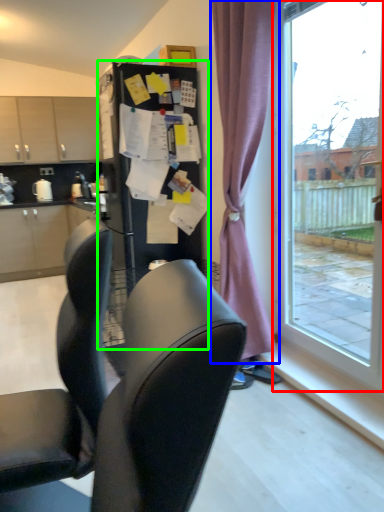
Question: Estimate the real-world distances between objects in this image. Which object is closer to window (highlighted by a red box), curtain (highlighted by a blue box) or fridge (highlighted by a green box)?

Choices:
 (A) curtain
 (B) fridge

Answer: (A)